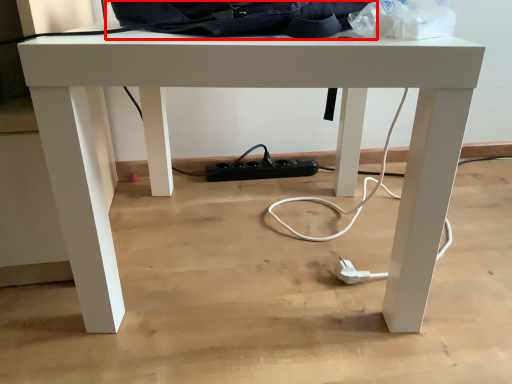
Question: Observing the image, what is the correct spatial positioning of messenger bag (annotated by the red box) in reference to paper bag?

Choices:
 (A) right
 (B) left

Answer: (B)